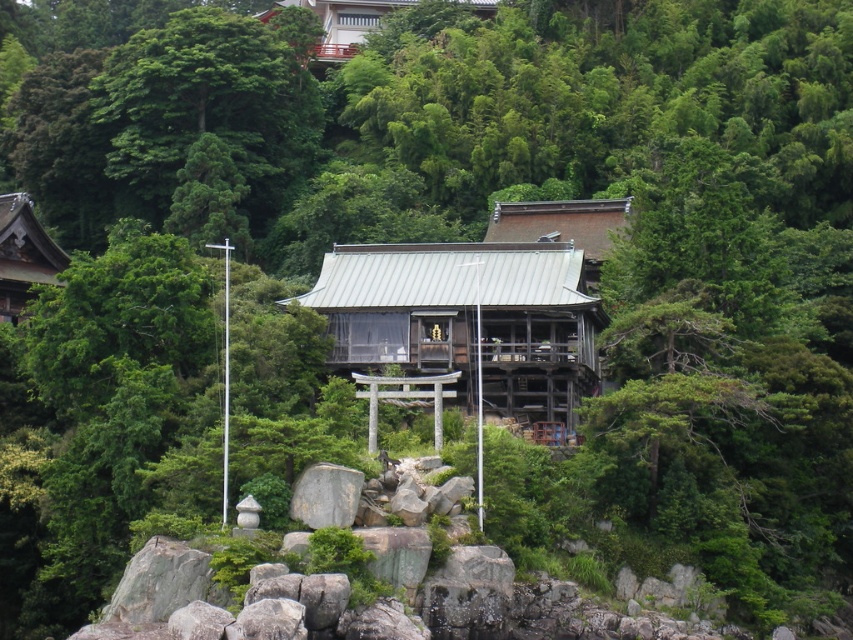
Is green wooden hut at center smaller than matte wooden shrine at upper left?

No.

Can you confirm if green wooden hut at center is thinner than matte wooden shrine at upper left?

In fact, green wooden hut at center might be wider than matte wooden shrine at upper left.

Locate an element on the screen. This screenshot has height=640, width=853. green wooden hut at center is located at coordinates (468, 320).

Is green wooden hut at center bigger than matte wooden hut at upper center?

Incorrect, green wooden hut at center is not larger than matte wooden hut at upper center.

Who is lower down, green wooden hut at center or matte wooden hut at upper center?

Positioned lower is green wooden hut at center.

Between point (374, 330) and point (471, 3), which one is positioned behind?

The point (471, 3) is more distant.

The width and height of the screenshot is (853, 640). I want to click on green wooden hut at center, so click(x=468, y=320).

Who is lower down, matte wooden shrine at upper left or matte wooden hut at upper center?

Positioned lower is matte wooden shrine at upper left.

Can you confirm if matte wooden shrine at upper left is positioned above matte wooden hut at upper center?

No.

Which is behind, point (47, 237) or point (398, 6)?

Point (398, 6)

Find the location of a particular element. Image resolution: width=853 pixels, height=640 pixels. matte wooden shrine at upper left is located at coordinates (22, 253).